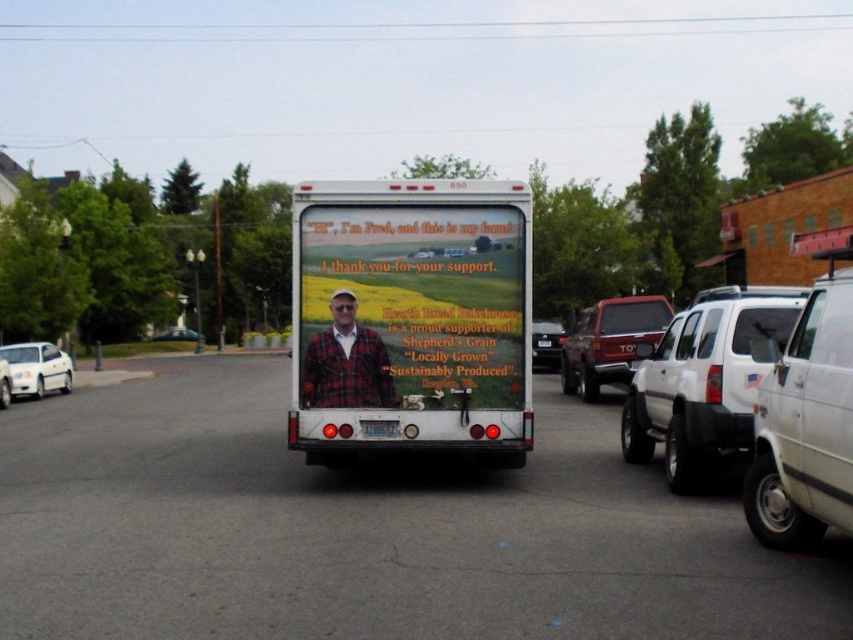
Between point (637, 300) and point (1, 401), which one is positioned in front?

Positioned in front is point (637, 300).

Which of these two, metallic red truck at center or white matte sedan at left, stands shorter?

With less height is white matte sedan at left.

Identify the location of metallic red truck at center. (608, 340).

Is point (61, 376) more distant than point (6, 371)?

Yes, it is.

Is white glossy sedan at left bigger than white matte sedan at left?

Correct, white glossy sedan at left is larger in size than white matte sedan at left.

Locate an element on the screen. This screenshot has height=640, width=853. white glossy sedan at left is located at coordinates (38, 369).

Does matte white truck at center appear on the right side of white matte suv at right?

In fact, matte white truck at center is to the left of white matte suv at right.

Does point (367, 284) come in front of point (776, 301)?

No, it is behind (776, 301).

Locate an element on the screen. This screenshot has width=853, height=640. matte white truck at center is located at coordinates (410, 317).